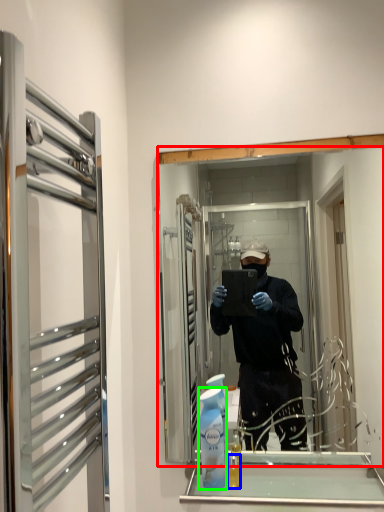
Question: Which is nearer to the mirror (highlighted by a red box)? mouthwash (highlighted by a blue box) or cleaning product (highlighted by a green box).

Choices:
 (A) mouthwash
 (B) cleaning product

Answer: (B)